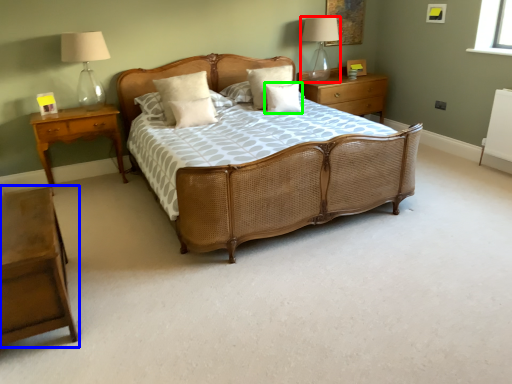
Question: Which object is positioned closest to table lamp (highlighted by a red box)? Select from nightstand (highlighted by a blue box) and pillow (highlighted by a green box).

Choices:
 (A) nightstand
 (B) pillow

Answer: (B)